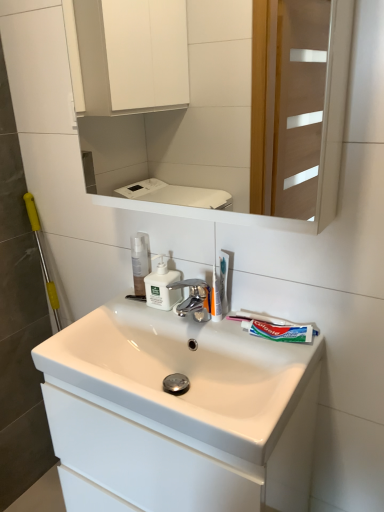
Question: Are white matte soap dispenser at center and translucent plastic toothbrush at upper center located far from each other?

Choices:
 (A) yes
 (B) no

Answer: (B)

Question: Is white matte soap dispenser at center facing towards translucent plastic toothbrush at upper center?

Choices:
 (A) no
 (B) yes

Answer: (A)

Question: Is white matte soap dispenser at center to the right of translucent plastic toothbrush at upper center from the viewer's perspective?

Choices:
 (A) no
 (B) yes

Answer: (A)

Question: Can you confirm if white matte soap dispenser at center is taller than translucent plastic toothbrush at upper center?

Choices:
 (A) no
 (B) yes

Answer: (A)

Question: From the image's perspective, does white matte soap dispenser at center appear lower than translucent plastic toothbrush at upper center?

Choices:
 (A) yes
 (B) no

Answer: (B)

Question: From the image's perspective, is white matte soap dispenser at center on translucent plastic toothbrush at upper center?

Choices:
 (A) no
 (B) yes

Answer: (B)

Question: Does translucent plastic toothbrush at upper center appear on the left side of translucent plastic toothbrush at center?

Choices:
 (A) no
 (B) yes

Answer: (A)

Question: Does translucent plastic toothbrush at upper center have a larger size compared to translucent plastic toothbrush at center?

Choices:
 (A) no
 (B) yes

Answer: (A)

Question: From a real-world perspective, is translucent plastic toothbrush at upper center under translucent plastic toothbrush at center?

Choices:
 (A) yes
 (B) no

Answer: (A)

Question: Does translucent plastic toothbrush at upper center have a lesser width compared to translucent plastic toothbrush at center?

Choices:
 (A) no
 (B) yes

Answer: (B)

Question: Considering the relative sizes of translucent plastic toothbrush at upper center and translucent plastic toothbrush at center in the image provided, is translucent plastic toothbrush at upper center shorter than translucent plastic toothbrush at center?

Choices:
 (A) no
 (B) yes

Answer: (B)

Question: Is translucent plastic toothbrush at upper center turned away from translucent plastic toothbrush at center?

Choices:
 (A) no
 (B) yes

Answer: (B)

Question: From the image's perspective, is translucent plastic toothbrush at center on top of translucent plastic toothbrush at upper center?

Choices:
 (A) yes
 (B) no

Answer: (B)